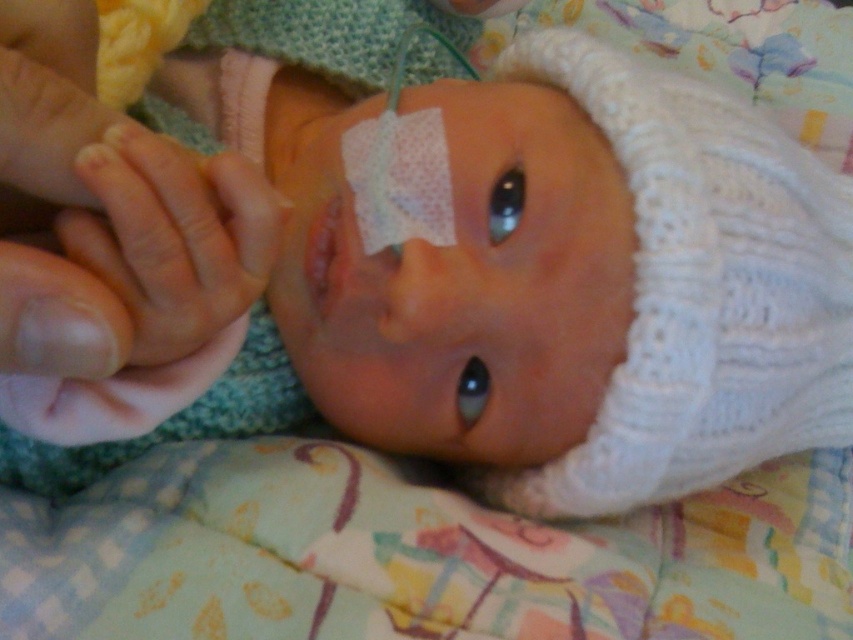
Is point (543, 396) more distant than point (177, 163)?

Yes, point (543, 396) is behind point (177, 163).

Is point (430, 346) farther from viewer compared to point (167, 321)?

Yes.

I want to click on matte plastic eye patch at center, so click(456, 275).